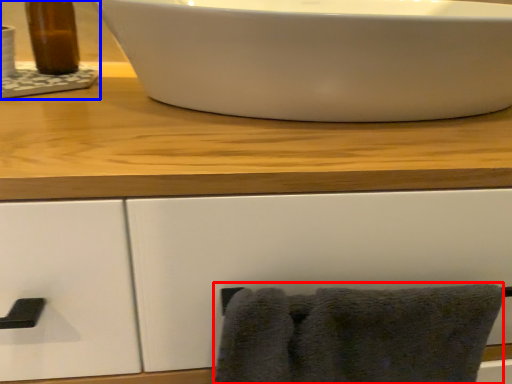
Question: Which object is further to the camera taking this photo, bath towel (highlighted by a red box) or sink (highlighted by a blue box)?

Choices:
 (A) bath towel
 (B) sink

Answer: (B)